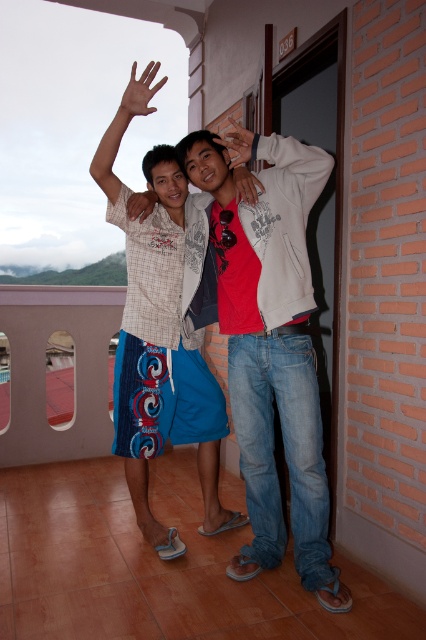
Question: Among these objects, which one is farthest from the camera?

Choices:
 (A) white matte jacket at upper center
 (B) blue denim shorts at left
 (C) matte white hand at center

Answer: (C)

Question: Can you confirm if brown matte hand at upper left is smaller than matte white hand at center?

Choices:
 (A) no
 (B) yes

Answer: (A)

Question: Among these objects, which one is farthest from the camera?

Choices:
 (A) white matte jacket at upper center
 (B) matte brown hand at center
 (C) matte black hand at upper center
 (D) blue denim shorts at left

Answer: (B)

Question: Is matte plaid shirt at upper left to the left of matte brown hand at center from the viewer's perspective?

Choices:
 (A) yes
 (B) no

Answer: (A)

Question: Does matte plaid shirt at upper left appear on the left side of matte brown hand at center?

Choices:
 (A) yes
 (B) no

Answer: (A)

Question: Which object is positioned farthest from the matte black hand at upper center?

Choices:
 (A) matte brown hand at center
 (B) matte plaid shirt at upper left

Answer: (B)